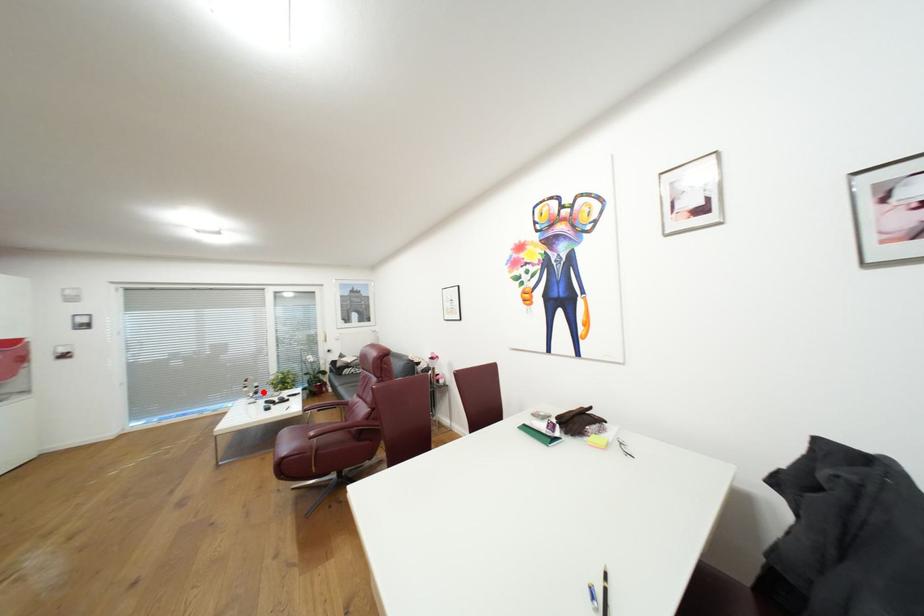
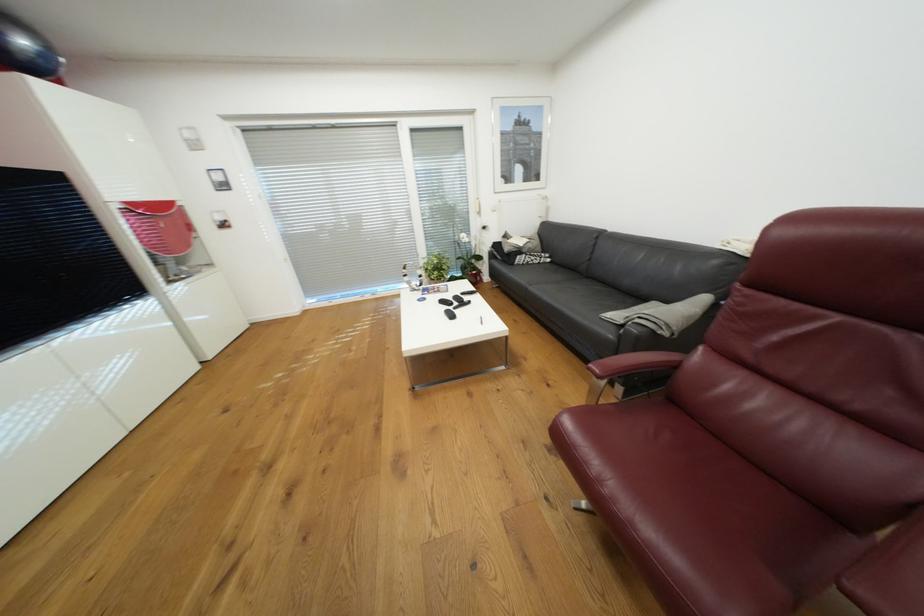
Find the pixel in the second image that matches the highlighted location in the first image.

(427, 284)